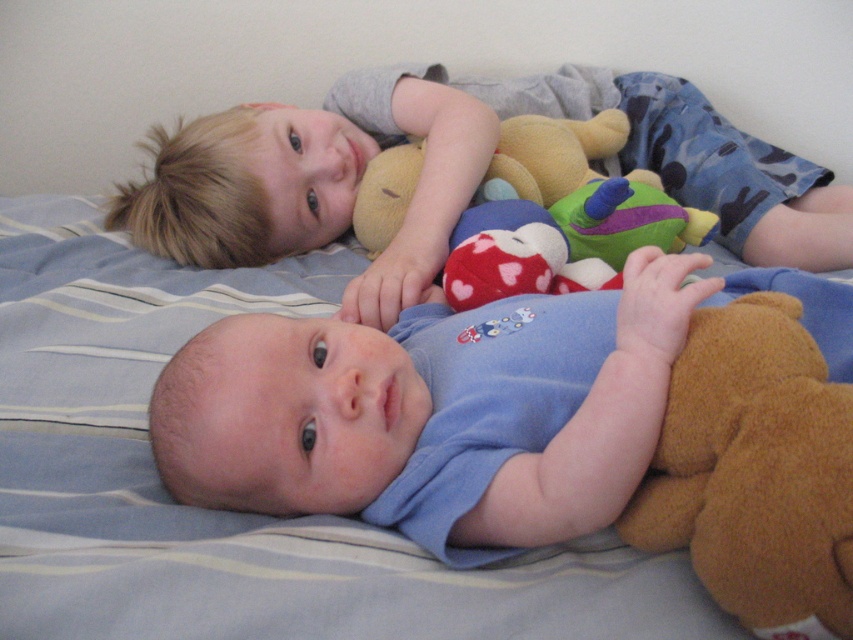
Can you confirm if blue soft bed at center is taller than brown plush bear at lower right?

Indeed, blue soft bed at center has a greater height compared to brown plush bear at lower right.

Where is `blue soft bed at center`? This screenshot has height=640, width=853. blue soft bed at center is located at coordinates (223, 512).

Find the location of a particular element. This screenshot has height=640, width=853. blue soft bed at center is located at coordinates (223, 512).

Between point (402, 464) and point (816, 182), which one is positioned behind?

Positioned behind is point (816, 182).

Where is `blue soft baby at center`? blue soft baby at center is located at coordinates (434, 412).

At what (x,y) coordinates should I click in order to perform the action: click on blue soft baby at center. Please return your answer as a coordinate pair (x, y). Looking at the image, I should click on pyautogui.click(x=434, y=412).

Locate an element on the screen. blonde hair at upper left is located at coordinates (312, 182).

Does blonde hair at upper left come in front of brown plush bear at lower right?

No, it is not.

Is point (706, 164) closer to camera compared to point (833, 404)?

No, it is behind (833, 404).

You are a GUI agent. You are given a task and a screenshot of the screen. Output one action in this format:
    pyautogui.click(x=<x>, y=<y>)
    Task: Click on the blonde hair at upper left
    The image size is (853, 640).
    Given the screenshot: What is the action you would take?
    pyautogui.click(x=312, y=182)